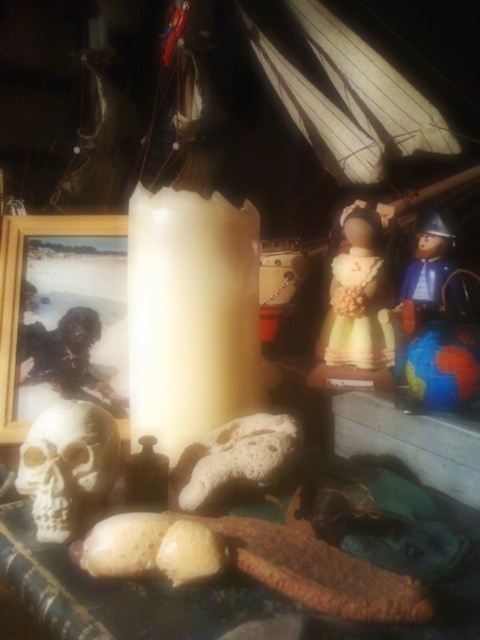
You are an interior designer arranging a themed display. You have a white matte skull at lower left and a matte yellow doll at center. According to the scene, which object is placed to the left of the other?

The white matte skull at lower left is positioned on the left side of the matte yellow doll at center.

You are an interior designer arranging items on a table. You have a white matte skull at lower left and a wooden photo frame at left. According to the scene, which object is positioned lower on the table?

The white matte skull at lower left is positioned lower on the table than the wooden photo frame at left.

You are a collector who wants to place a new 12 inch wide decorative item between the white matte skull at lower left and the matte yellow doll at center. Can you fit it without overlapping either object?

The distance between the white matte skull at lower left and the matte yellow doll at center is 15.68 inches. Since the new item is 12 inches wide, there is enough space to place it between them without overlapping.